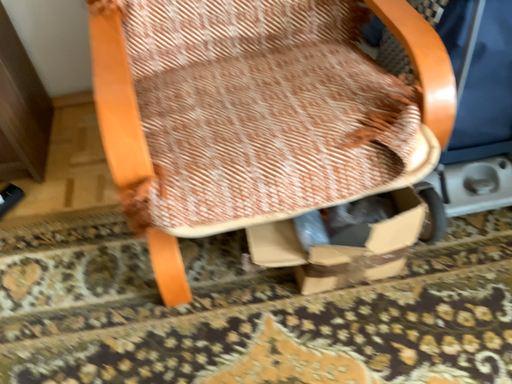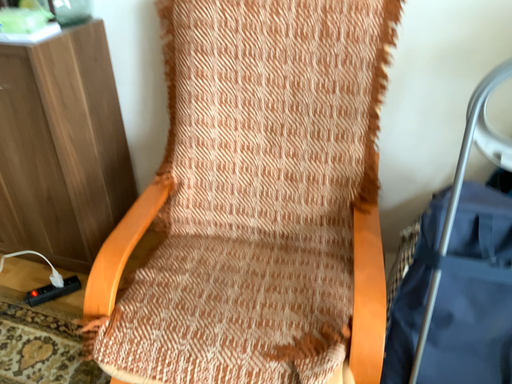
Question: How did the camera likely rotate when shooting the video?

Choices:
 (A) rotated downward
 (B) rotated upward

Answer: (B)